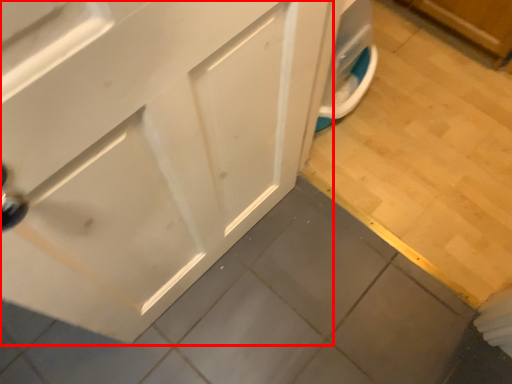
Question: In this image, where is cabinetry (annotated by the red box) located relative to tile?

Choices:
 (A) right
 (B) left

Answer: (B)